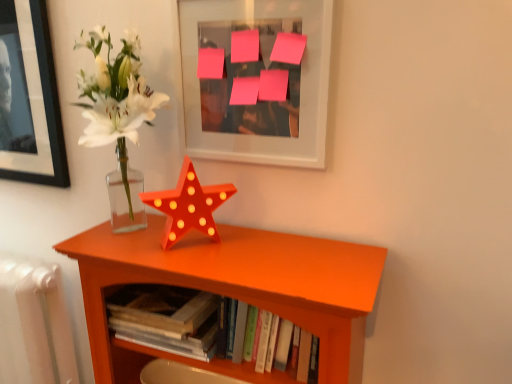
Where is `blank space above orange wood shelf at center (from a real-world perspective)`? This screenshot has width=512, height=384. blank space above orange wood shelf at center (from a real-world perspective) is located at coordinates (226, 250).